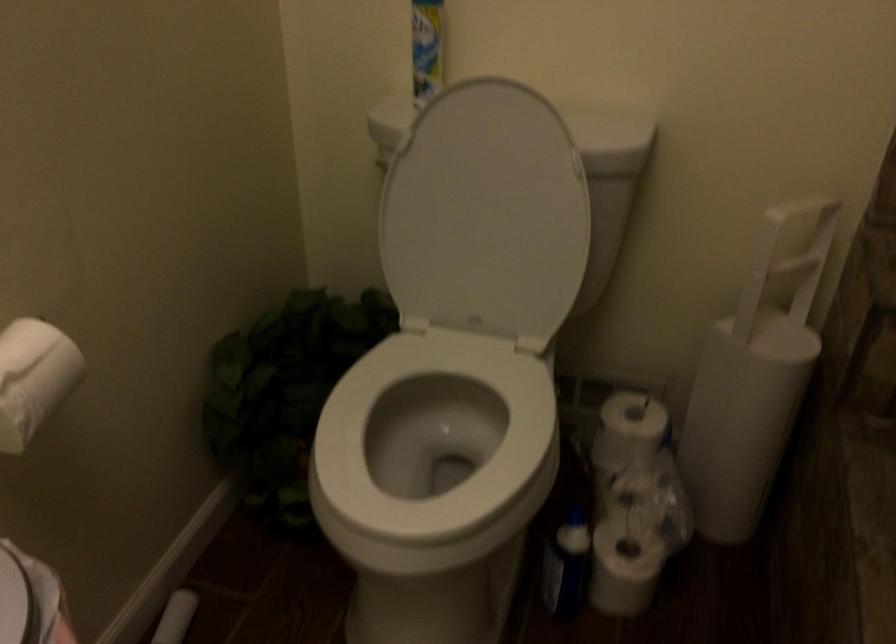
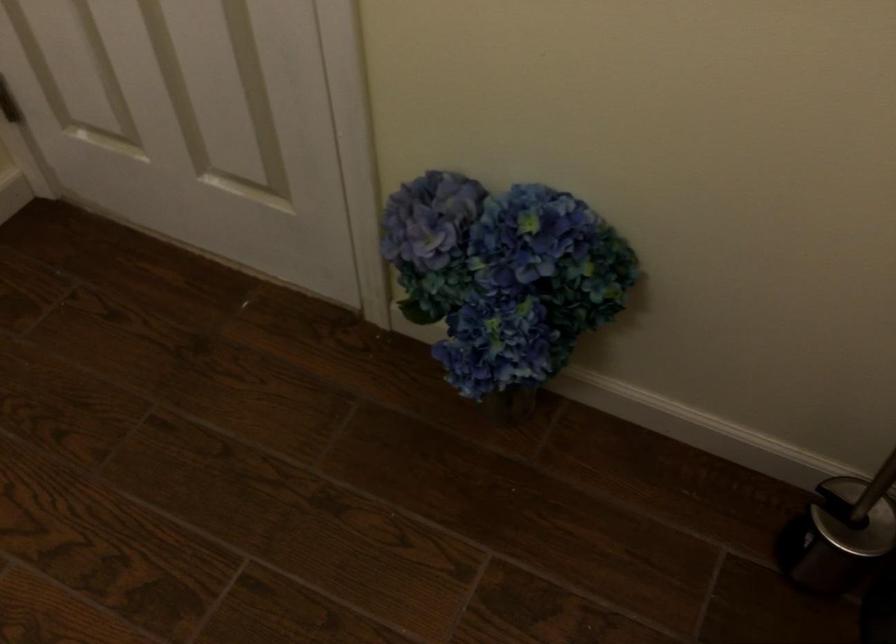
The images are taken continuously from a first-person perspective. In which direction is your viewpoint rotating?

The camera's rotation is toward left-down.